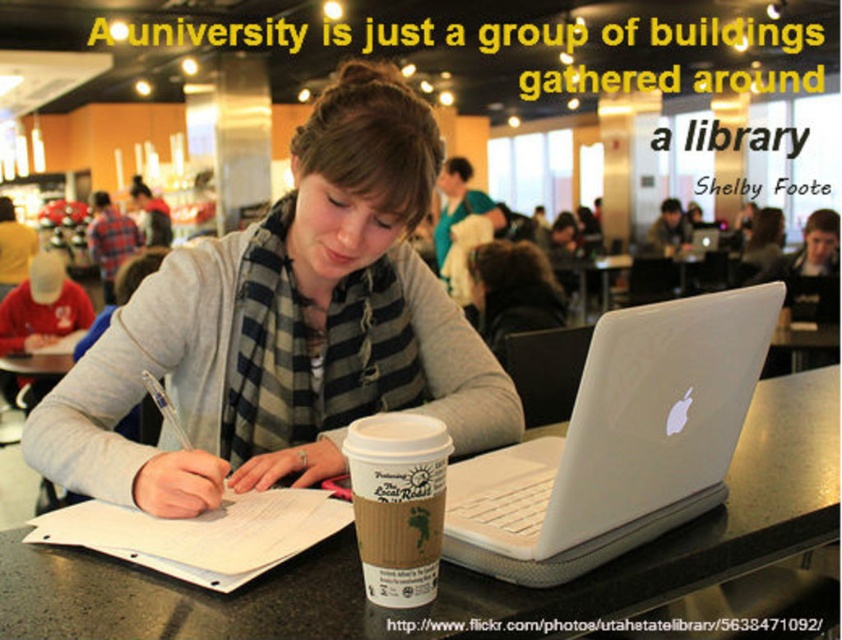
Can you confirm if white plastic laptop at center is positioned to the right of brown paper cup at center?

Correct, you'll find white plastic laptop at center to the right of brown paper cup at center.

What do you see at coordinates (619, 442) in the screenshot? This screenshot has height=640, width=842. I see `white plastic laptop at center` at bounding box center [619, 442].

Identify the location of white plastic laptop at center. (619, 442).

Is black plastic table at center to the left of white plastic laptop at center from the viewer's perspective?

In fact, black plastic table at center is to the right of white plastic laptop at center.

Describe the element at coordinates (461, 566) in the screenshot. This screenshot has width=842, height=640. I see `black plastic table at center` at that location.

Where is `black plastic table at center`? The width and height of the screenshot is (842, 640). black plastic table at center is located at coordinates (461, 566).

In the scene shown: Who is lower down, white plastic laptop at center or plaid scarf at center?

white plastic laptop at center is lower down.

Does white plastic laptop at center appear over plaid scarf at center?

No.

In order to click on white plastic laptop at center in this screenshot , I will do `click(619, 442)`.